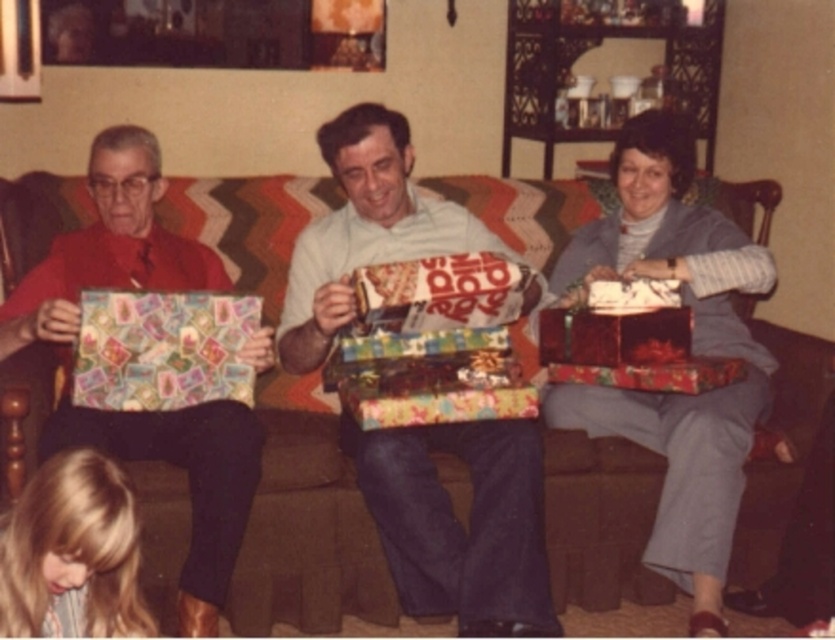
You are a guest at this holiday gathering and want to admire the shiny metallic gift at center and the matte gray sweater at center. Which object is positioned higher in the image?

The shiny metallic gift at center is positioned higher than the matte gray sweater at center in the image.

You are a guest at the holiday gathering and want to hand a gift to the person sitting on the brown fabric couch at center. However, there is a matte red card at left in the way. Which object should you move first to reach the couch?

You should move the matte red card at left first because the brown fabric couch at center is further away from you, so the matte red card at left is closer and blocking the path.